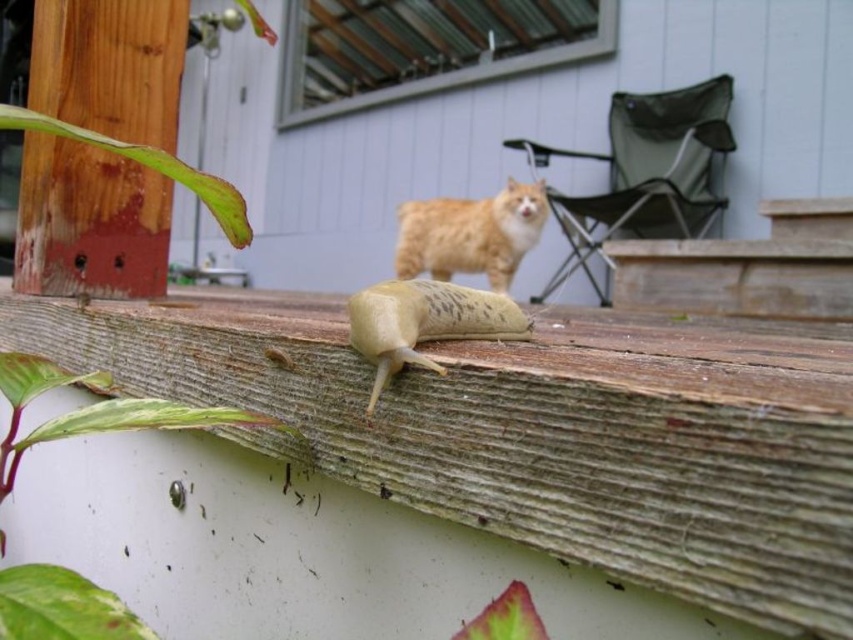
Who is positioned more to the right, pale yellow/greenish translucent at center or fuzzy orange cat at center?

Positioned to the right is fuzzy orange cat at center.

Does pale yellow/greenish translucent at center appear over fuzzy orange cat at center?

No.

Image resolution: width=853 pixels, height=640 pixels. I want to click on pale yellow/greenish translucent at center, so click(x=425, y=323).

Where is `pale yellow/greenish translucent at center`? The image size is (853, 640). pale yellow/greenish translucent at center is located at coordinates pos(425,323).

Which is behind, point (219, 378) or point (477, 252)?

Point (477, 252)

Which of these two, wooden plank at center or fuzzy orange cat at center, stands taller?

Standing taller between the two is fuzzy orange cat at center.

Who is more distant from viewer, (722, 332) or (465, 224)?

The point (465, 224) is behind.

This screenshot has height=640, width=853. Find the location of `wooden plank at center`. wooden plank at center is located at coordinates click(x=537, y=429).

Describe the element at coordinates (537, 429) in the screenshot. This screenshot has height=640, width=853. I see `wooden plank at center` at that location.

Between point (714, 484) and point (360, 312), which one is positioned behind?

The point (360, 312) is more distant.

I want to click on wooden plank at center, so [x=537, y=429].